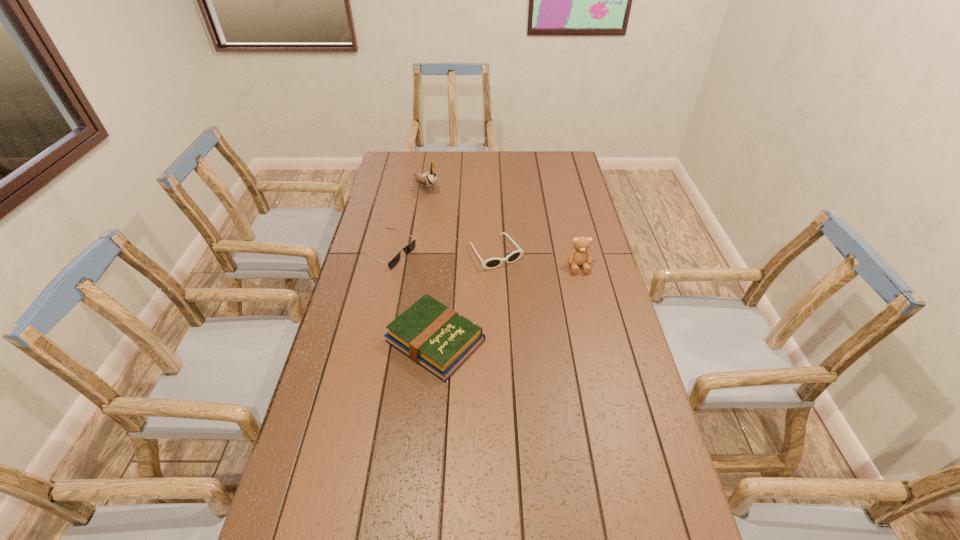
At what (x,y) coordinates should I click in order to perform the action: click on vacant area that lies between the left sunglasses and the farthest object. Please return your answer as a coordinate pair (x, y). The height and width of the screenshot is (540, 960). Looking at the image, I should click on (407, 220).

Locate an element on the screen. vacant area that lies between the bird and the third tallest object is located at coordinates (431, 264).

Locate an element on the screen. The image size is (960, 540). free spot between the rightmost object and the left sunglasses is located at coordinates (483, 259).

I want to click on empty space that is in between the nearest object and the bird, so click(431, 264).

I want to click on unoccupied position between the nearest object and the right sunglasses, so click(x=466, y=296).

Where is `vacant area between the rightmost object and the right sunglasses`? Image resolution: width=960 pixels, height=540 pixels. vacant area between the rightmost object and the right sunglasses is located at coordinates (538, 260).

I want to click on free space between the bird and the left sunglasses, so click(x=407, y=220).

You are a GUI agent. You are given a task and a screenshot of the screen. Output one action in this format:
    pyautogui.click(x=<x>, y=<y>)
    Task: Click on the empty space between the nearest object and the farthest object
    This screenshot has height=540, width=960.
    Given the screenshot: What is the action you would take?
    pyautogui.click(x=431, y=264)

The height and width of the screenshot is (540, 960). Identify the location of free space between the third shortest object and the right sunglasses. (466, 296).

Image resolution: width=960 pixels, height=540 pixels. I want to click on object that is the third closest to the nearest object, so click(580, 256).